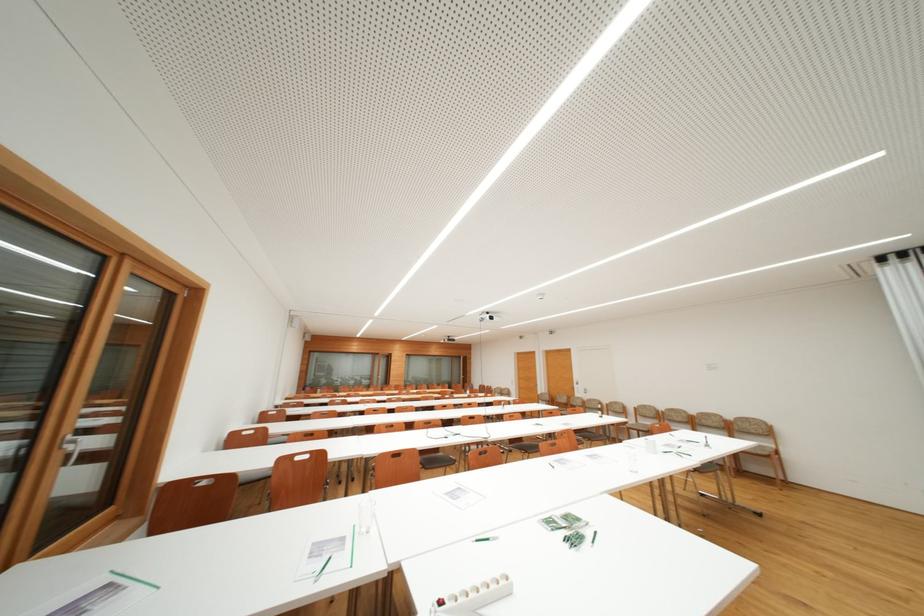
The width and height of the screenshot is (924, 616). I want to click on white door handle, so click(x=70, y=448).